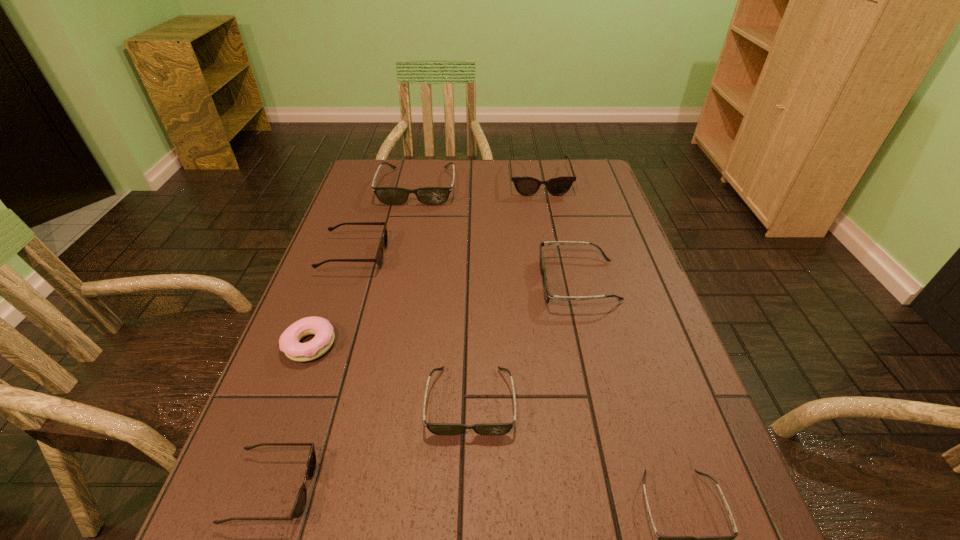
The height and width of the screenshot is (540, 960). In order to click on the rightmost brown sunglasses in this screenshot , I will do `click(526, 186)`.

This screenshot has width=960, height=540. Find the location of `the biggest brown sunglasses`. the biggest brown sunglasses is located at coordinates (526, 186).

At what (x,y) coordinates should I click in order to perform the action: click on the biggest black sunglasses. Please return your answer as a coordinate pair (x, y). Image resolution: width=960 pixels, height=540 pixels. Looking at the image, I should click on (388, 195).

Find the location of a particular element. This screenshot has width=960, height=540. the second smallest brown sunglasses is located at coordinates (378, 259).

The image size is (960, 540). Find the location of `the third nearest black sunglasses`. the third nearest black sunglasses is located at coordinates (x=548, y=296).

This screenshot has height=540, width=960. Find the location of `doughnut`. doughnut is located at coordinates (289, 343).

The height and width of the screenshot is (540, 960). Find the location of `pink doughnut`. pink doughnut is located at coordinates (289, 343).

At what (x,y) coordinates should I click in order to perform the action: click on the second nearest black sunglasses. Please return your answer as a coordinate pair (x, y). Looking at the image, I should click on (436, 428).

Find the location of a particular element. The width and height of the screenshot is (960, 540). the second smallest black sunglasses is located at coordinates tap(436, 428).

Locate an element on the screen. the nearest brown sunglasses is located at coordinates (300, 503).